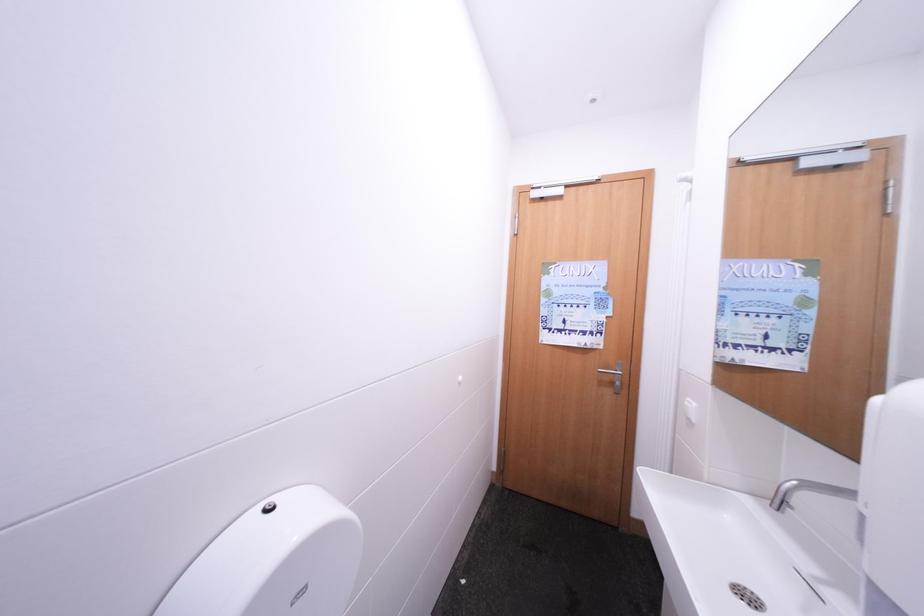
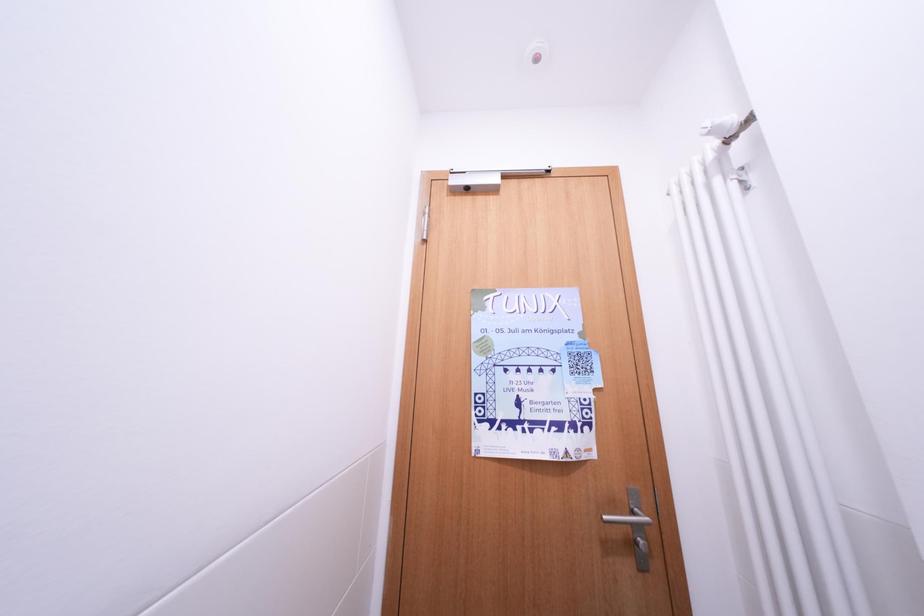
Based on the continuous images, in which direction is the camera rotating?

The camera's rotation is toward right-up.